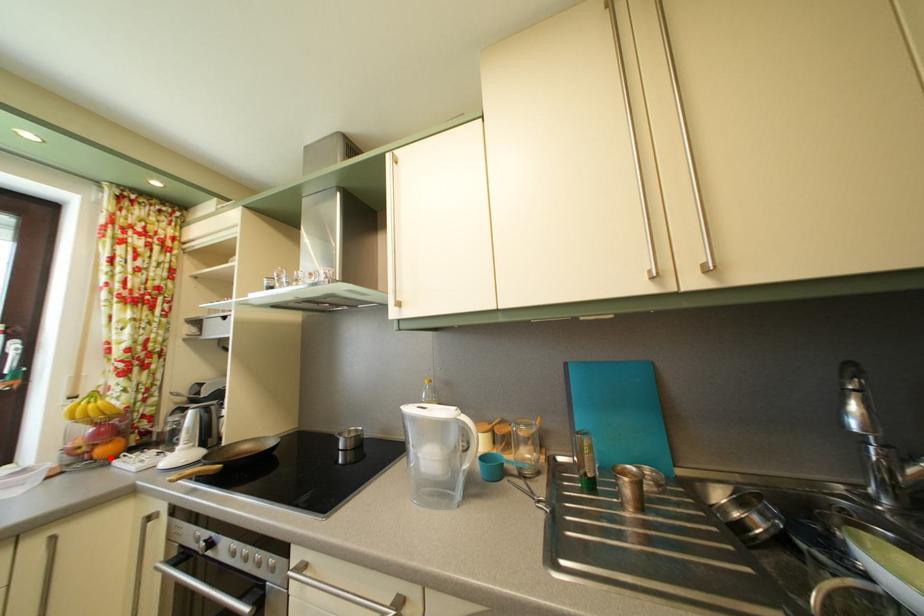
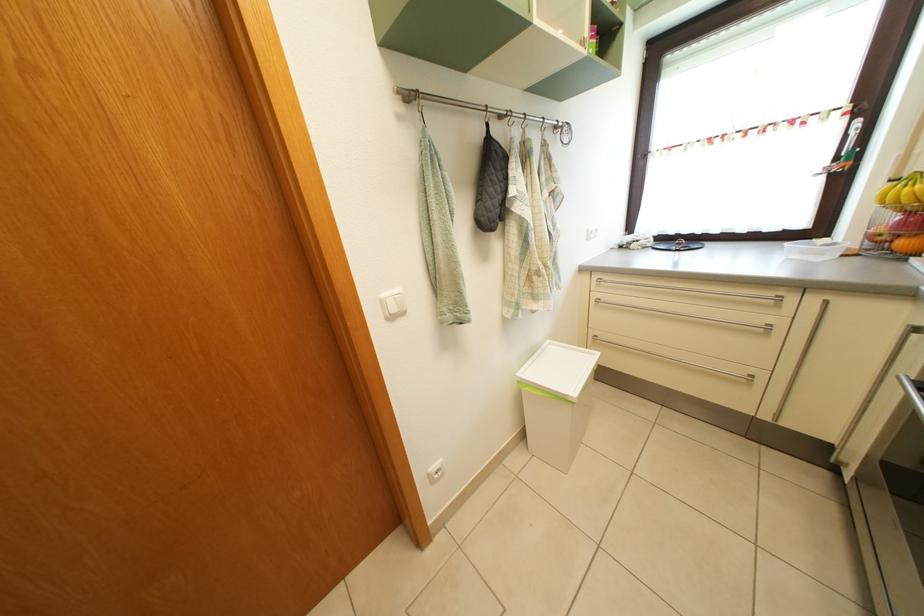
Question: I am providing you with two images of the same scene from different viewpoints. Given a red point in image1, look at the same physical point in image2. Is it:

Choices:
 (A) Closer to the viewpoint
 (B) Farther from the viewpoint

Answer: (B)